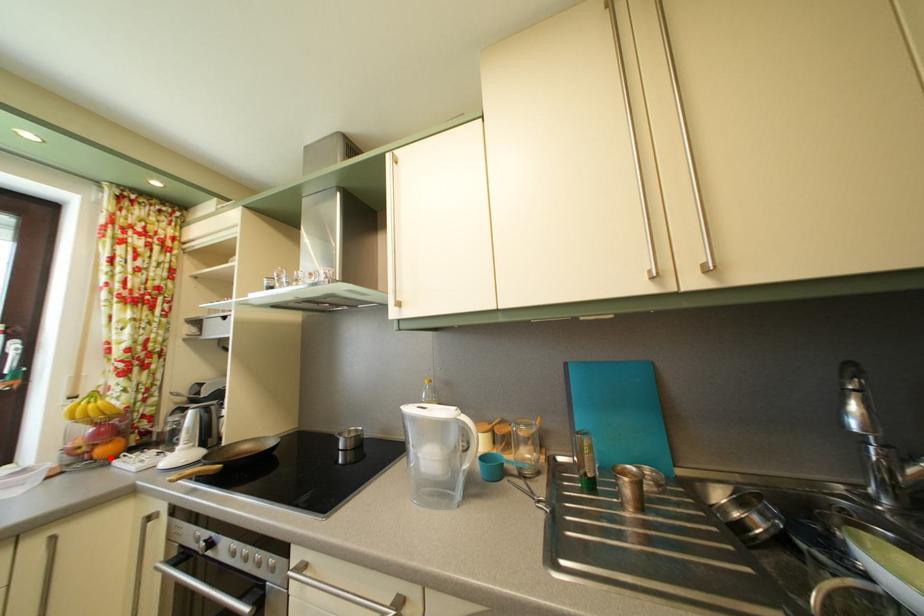
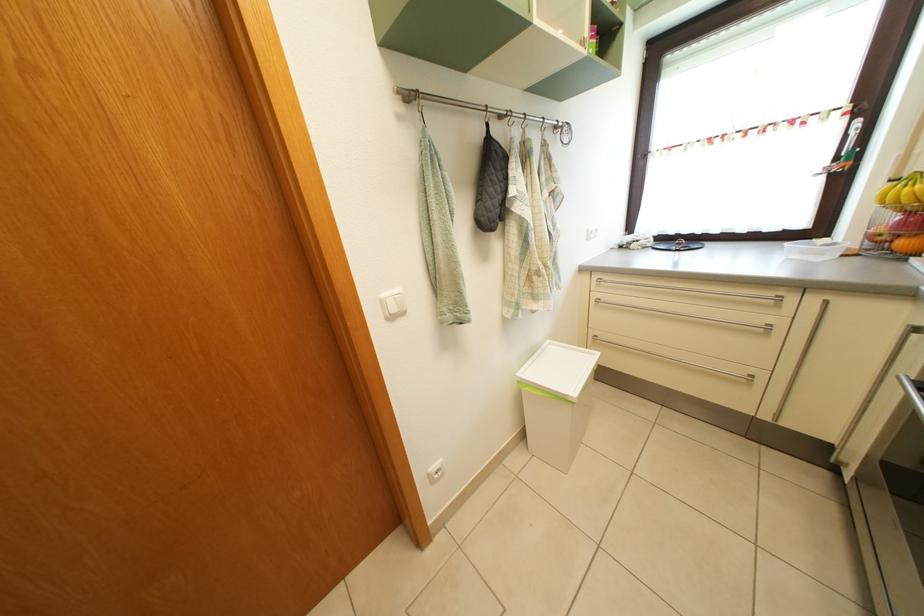
Question: I am providing you with two images of the same scene from different viewpoints. Given a red point in image1, look at the same physical point in image2. Is it:

Choices:
 (A) Closer to the viewpoint
 (B) Farther from the viewpoint

Answer: (B)